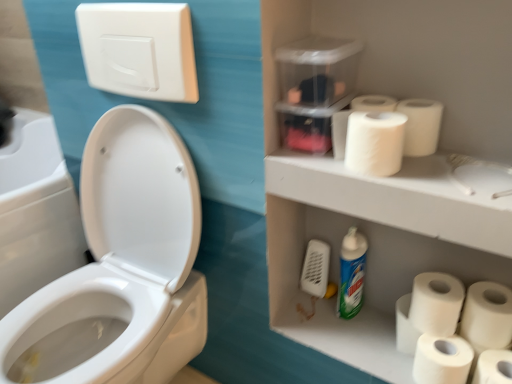
Question: Is white matte paper towel at upper right at the left side of white matte toilet paper at lower right, the 3th toilet paper when ordered from top to bottom?

Choices:
 (A) no
 (B) yes

Answer: (B)

Question: Is white matte toilet paper at lower right, which appears as the fourth toilet paper when ordered from the bottom, inside white matte paper towel at upper right?

Choices:
 (A) yes
 (B) no

Answer: (B)

Question: Does white matte paper towel at upper right have a greater height compared to white matte toilet paper at lower right, which appears as the fourth toilet paper when ordered from the bottom?

Choices:
 (A) yes
 (B) no

Answer: (B)

Question: From a real-world perspective, is white matte paper towel at upper right on white matte toilet paper at lower right, the 3th toilet paper when ordered from top to bottom?

Choices:
 (A) yes
 (B) no

Answer: (A)

Question: Considering the relative sizes of white matte paper towel at upper right and white matte toilet paper at lower right, the 3th toilet paper when ordered from top to bottom, in the image provided, is white matte paper towel at upper right bigger than white matte toilet paper at lower right, the 3th toilet paper when ordered from top to bottom,?

Choices:
 (A) yes
 (B) no

Answer: (B)

Question: Does white matte paper towel at upper right appear on the right side of white matte toilet paper at lower right, the 3th toilet paper when ordered from top to bottom?

Choices:
 (A) yes
 (B) no

Answer: (B)

Question: Is white glossy toilet at left at the back of white matte toilet paper at upper right, the 1th toilet paper from the top?

Choices:
 (A) no
 (B) yes

Answer: (A)

Question: Is white matte toilet paper at upper right, the 1th toilet paper from the top, with white glossy toilet at left?

Choices:
 (A) no
 (B) yes

Answer: (A)

Question: From a real-world perspective, is white matte toilet paper at upper right, which ranks as the sixth toilet paper in bottom-to-top order, located beneath white glossy toilet at left?

Choices:
 (A) yes
 (B) no

Answer: (B)

Question: Does white matte toilet paper at upper right, the 1th toilet paper from the top, have a larger size compared to white glossy toilet at left?

Choices:
 (A) no
 (B) yes

Answer: (A)

Question: Is white matte toilet paper at upper right, the 1th toilet paper from the top, not close to white glossy toilet at left?

Choices:
 (A) no
 (B) yes

Answer: (A)

Question: Considering the relative sizes of white matte toilet paper at upper right, the 1th toilet paper from the top, and white glossy toilet at left in the image provided, is white matte toilet paper at upper right, the 1th toilet paper from the top, wider than white glossy toilet at left?

Choices:
 (A) no
 (B) yes

Answer: (A)

Question: Is white matte toilet paper at lower right, the 3th toilet paper ordered from the bottom, positioned in front of white matte toilet paper at lower right, which appears as the fourth toilet paper when ordered from the bottom?

Choices:
 (A) no
 (B) yes

Answer: (B)